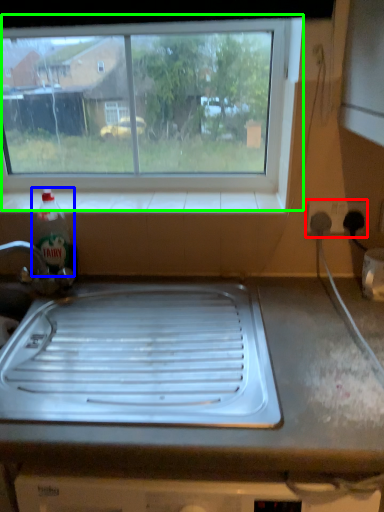
Question: Which object is positioned closest to electric outlet (highlighted by a red box)? Select from bottle (highlighted by a blue box) and window (highlighted by a green box).

Choices:
 (A) bottle
 (B) window

Answer: (B)